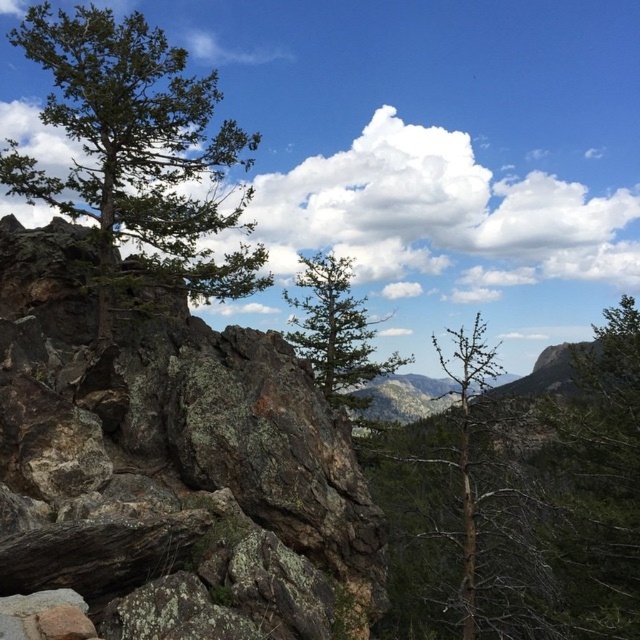
You are a hiker who wants to take a photo of the green matte tree at center without the rusty brown rock at left blocking the view. Based on the scene, can you position yourself so that the tree is fully visible without the rock in the frame?

The rusty brown rock at left is in front of the green matte tree at center, so if you move to a position where the rock is out of the frame, the tree should be fully visible without obstruction.

You are standing at the center of the image looking at the rugged landscape. There is a point marked at coordinates point (x=172, y=467). What color is the object located at that point?

The point (x=172, y=467) indicates rusty brown rock at left.

You are a hiker trying to navigate through the rocky terrain. You notice a rusty brown rock at left and a green rough bark tree at left. Which object is closer to your left side as you face the scene?

The green rough bark tree at left is closer to your left side since the rusty brown rock at left is positioned on the right side of it.